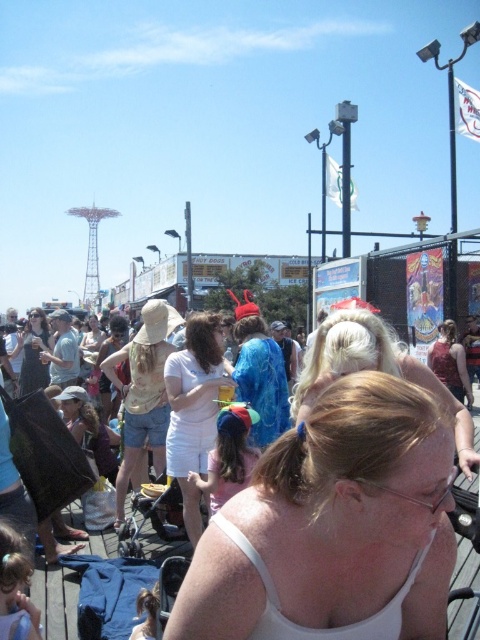
Looking at this image, you are a photographer at the fairground. You want to take a photo of both the white cotton dress at center and the blue sequined dress at center. However, you notice that one is blocking the other. Which dress is currently blocking the other?

The white cotton dress at center is in front of the blue sequined dress at center, so it is blocking the blue sequined dress at center.